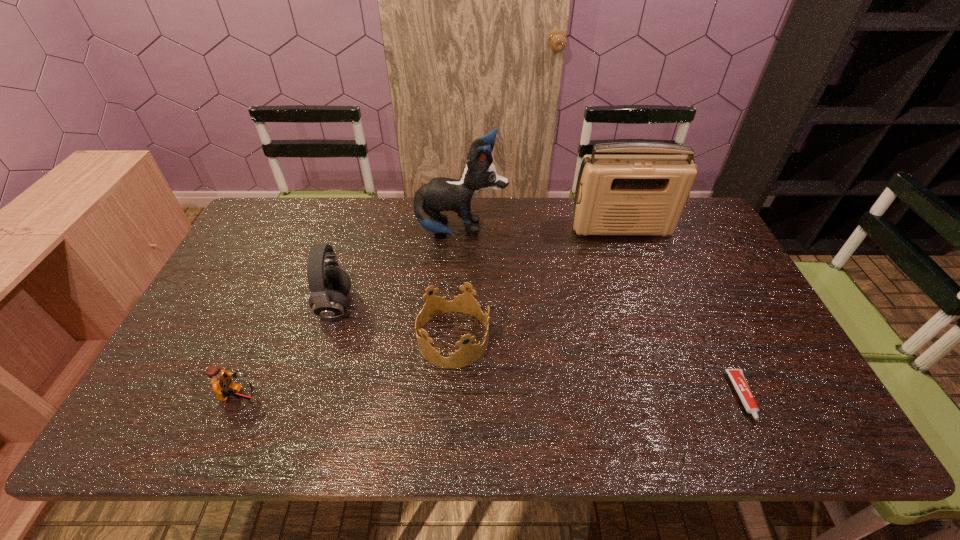
The width and height of the screenshot is (960, 540). In order to click on vacant point located between the tiara and the leftmost object in this screenshot , I will do `click(346, 368)`.

The width and height of the screenshot is (960, 540). In order to click on free space between the tiara and the puppy in this screenshot , I will do `click(457, 285)`.

The height and width of the screenshot is (540, 960). I want to click on vacant region between the tiara and the second object from left to right, so click(394, 322).

What are the coordinates of `empty location between the tiara and the headset` in the screenshot? It's located at [394, 322].

Find the location of a particular element. free point between the shortest object and the tiara is located at coordinates (597, 367).

This screenshot has height=540, width=960. Find the location of `vacant region between the toothpaste and the leftmost object`. vacant region between the toothpaste and the leftmost object is located at coordinates (491, 397).

Locate an element on the screen. free space between the tiara and the puppy is located at coordinates (457, 285).

Find the location of a particular element. This screenshot has width=960, height=540. empty space between the shortest object and the headset is located at coordinates (539, 350).

At what (x,y) coordinates should I click in order to perform the action: click on object that stands as the fifth closest to the Lego. Please return your answer as a coordinate pair (x, y). Looking at the image, I should click on (737, 377).

Where is `the third closest object to the headset`? Image resolution: width=960 pixels, height=540 pixels. the third closest object to the headset is located at coordinates (x=440, y=194).